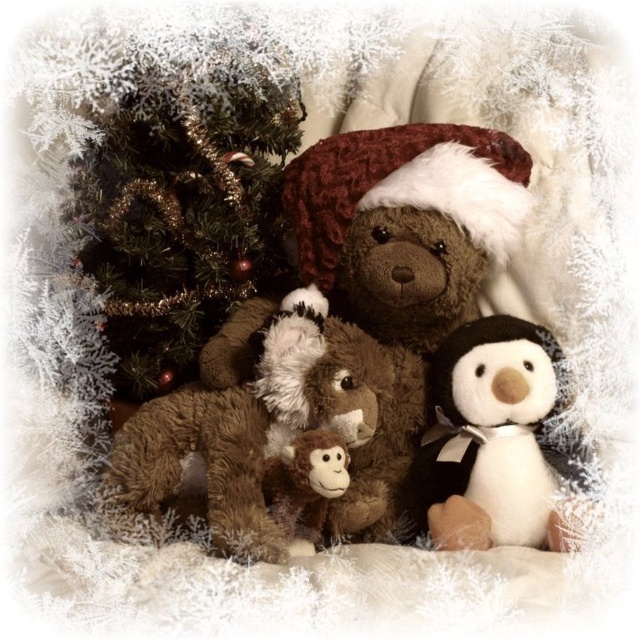
Which is more to the right, brown plush teddy bear at center or fuzzy brown bear at center?

fuzzy brown bear at center is more to the right.

Between point (289, 385) and point (307, 179), which one is positioned in front?

Point (289, 385)

Does point (157, 433) lie behind point (323, 264)?

No, (157, 433) is in front of (323, 264).

Locate an element on the screen. brown plush teddy bear at center is located at coordinates (225, 436).

Consider the image. Can you confirm if brown plush teddy bear at center is positioned to the right of brown plush monkey at center?

No, brown plush teddy bear at center is not to the right of brown plush monkey at center.

How much distance is there between brown plush teddy bear at center and brown plush monkey at center?

brown plush teddy bear at center and brown plush monkey at center are 3.14 inches apart.

Is point (161, 404) positioned before point (307, 481)?

That is False.

The image size is (640, 640). In order to click on brown plush teddy bear at center in this screenshot , I will do `click(225, 436)`.

Between point (305, 202) and point (307, 540), which one is positioned behind?

Positioned behind is point (305, 202).

Between fuzzy brown bear at center and brown plush monkey at center, which one has less height?

Standing shorter between the two is brown plush monkey at center.

Where is `fuzzy brown bear at center`? The height and width of the screenshot is (640, 640). fuzzy brown bear at center is located at coordinates (369, 179).

Locate an element on the screen. The width and height of the screenshot is (640, 640). fuzzy brown bear at center is located at coordinates (369, 179).